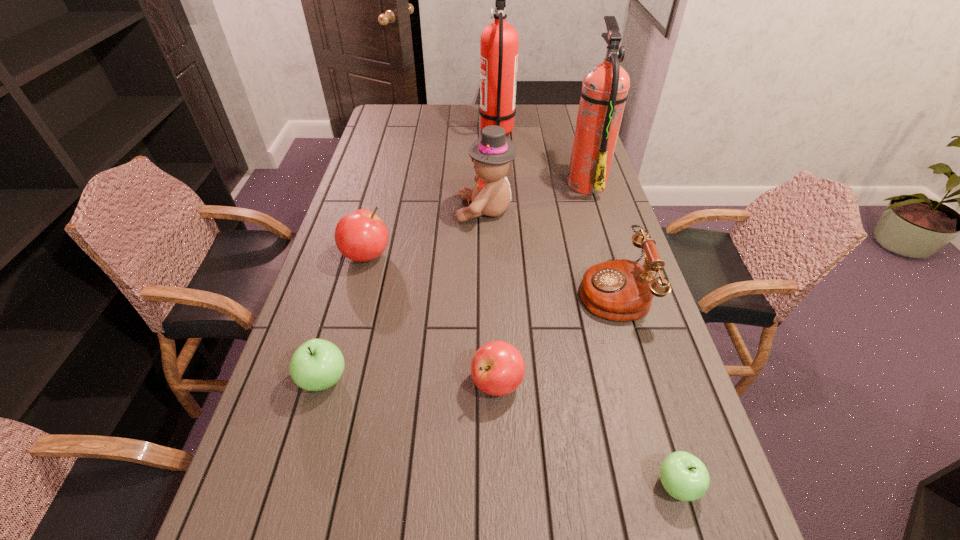
Identify the location of free space located 0.110m on the front-facing side of the rag_doll. (423, 210).

At what (x,y) coordinates should I click in order to perform the action: click on vacant space located on the front-facing side of the rag_doll. Please return your answer as a coordinate pair (x, y). The image size is (960, 540). Looking at the image, I should click on (385, 210).

Find the location of a particular element. This screenshot has width=960, height=540. free spot located 0.320m on the dial of the telephone is located at coordinates (463, 290).

Locate an element on the screen. The height and width of the screenshot is (540, 960). free space located 0.360m on the dial of the telephone is located at coordinates (448, 290).

The width and height of the screenshot is (960, 540). What are the coordinates of `free space located on the dial of the telephone` in the screenshot? It's located at (455, 290).

At what (x,y) coordinates should I click in order to perform the action: click on free location located 0.100m on the back of the tallest apple. Please return your answer as a coordinate pair (x, y). This screenshot has height=540, width=960. Looking at the image, I should click on (376, 219).

The width and height of the screenshot is (960, 540). Identify the location of free space located 0.320m on the back of the farther green apple. (356, 268).

Identify the location of vacant space situated 0.210m on the left of the smaller red apple. The width and height of the screenshot is (960, 540). (379, 383).

In order to click on vacant area situated 0.100m on the back of the nearer green apple in this screenshot , I will do `click(656, 417)`.

Image resolution: width=960 pixels, height=540 pixels. In order to click on object located in the far edge section of the desktop in this screenshot , I will do `click(499, 41)`.